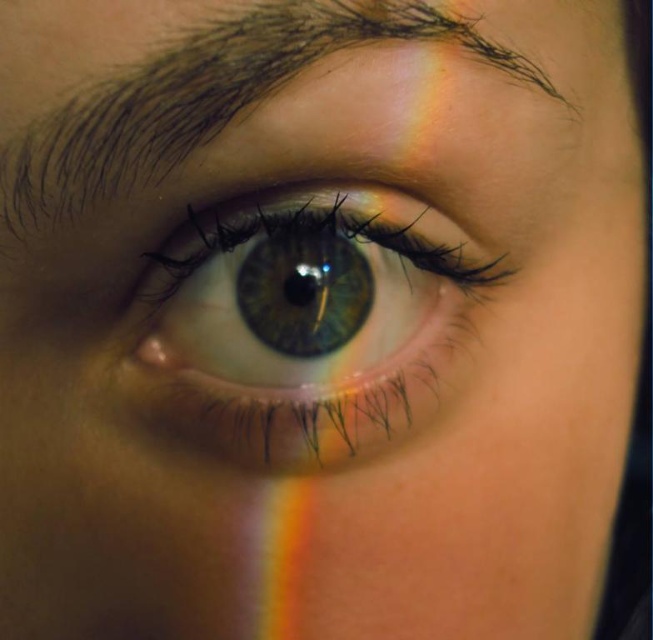
You are an optometrist examining a patient. You notice a point at coordinates [302,323] in the image. Based on the scene description, what anatomical structure does this point most likely correspond to?

The point at [302,323] corresponds to the green iridescent eye at center, which is the iris.